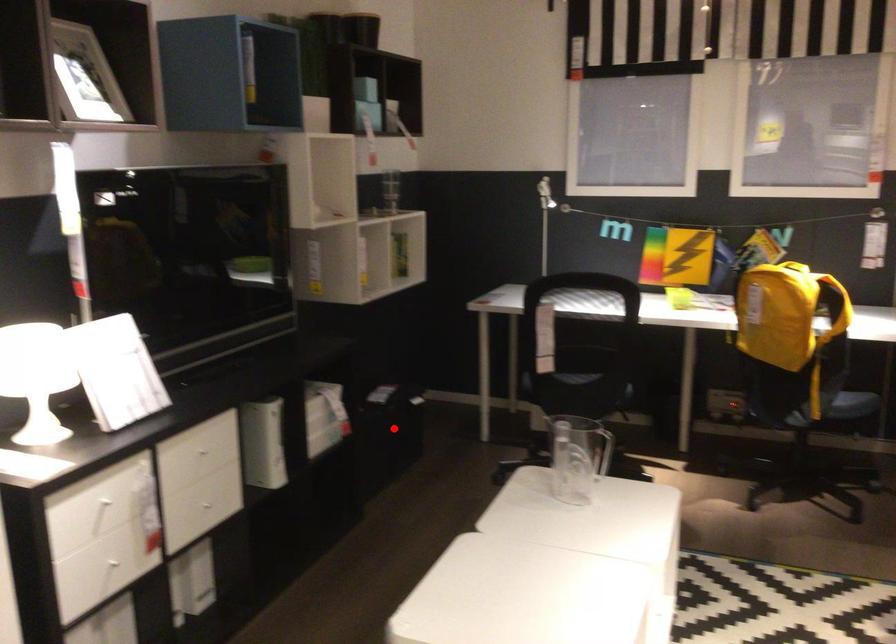
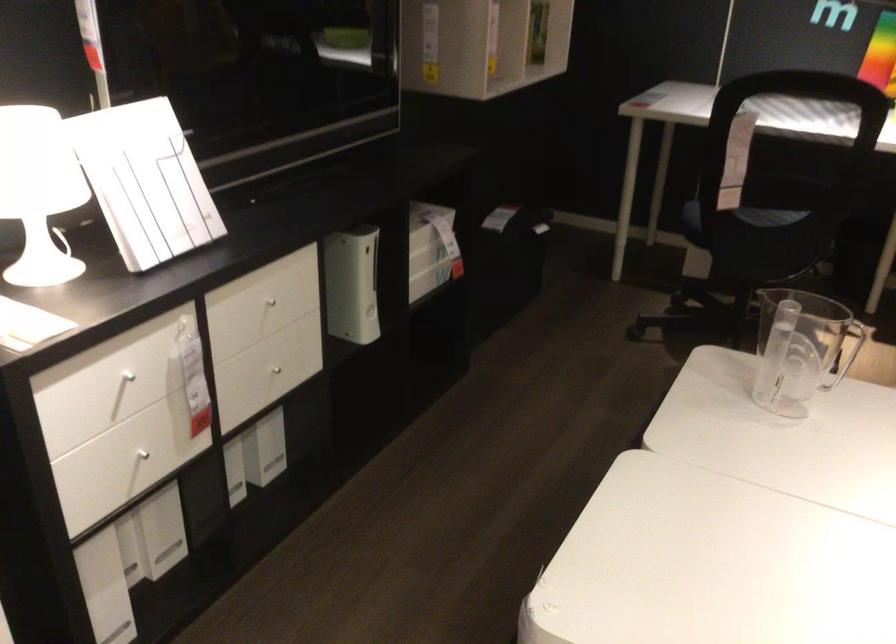
Find the pixel in the second image that matches the highlighted location in the first image.

(507, 263)